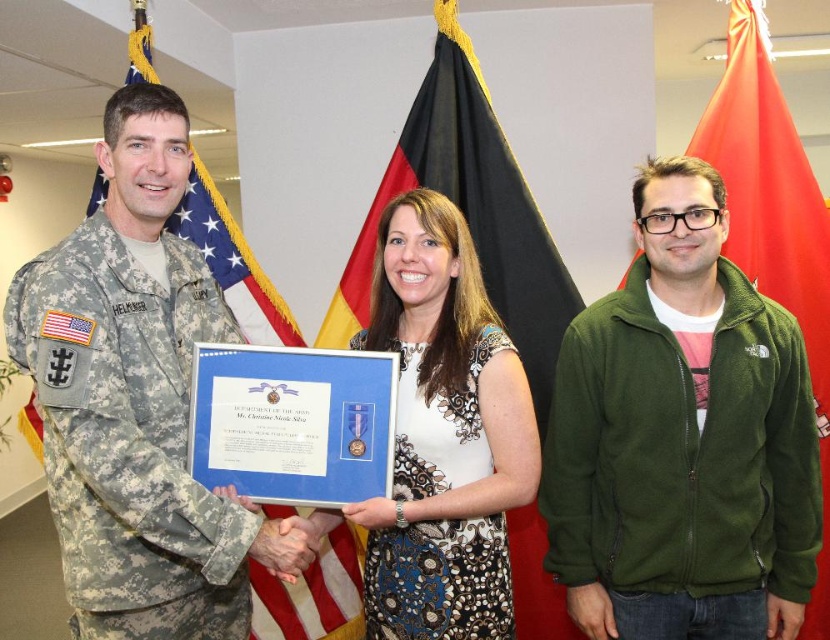
Can you confirm if matte blue fabric at center is positioned to the right of american flag at left?

Yes, matte blue fabric at center is to the right of american flag at left.

Is matte blue fabric at center taller than american flag at left?

Indeed, matte blue fabric at center has a greater height compared to american flag at left.

This screenshot has height=640, width=830. In order to click on matte blue fabric at center in this screenshot , I will do `click(438, 580)`.

Is black fabric flag at center smaller than matte blue fabric at center?

Actually, black fabric flag at center might be larger than matte blue fabric at center.

Measure the distance between point (x=530, y=301) and camera.

They are 2.25 meters apart.

In order to click on black fabric flag at center in this screenshot , I will do `click(470, 205)`.

Can you confirm if green fleece jacket at center is positioned above matte blue fabric at center?

Yes, green fleece jacket at center is above matte blue fabric at center.

Is point (706, 304) positioned in front of point (430, 438)?

No, it is behind (430, 438).

Does point (637, 200) come farther from viewer compared to point (482, 464)?

Yes, point (637, 200) is farther from viewer.

At what (x,y) coordinates should I click in order to perform the action: click on green fleece jacket at center. Please return your answer as a coordinate pair (x, y). This screenshot has width=830, height=640. Looking at the image, I should click on (682, 438).